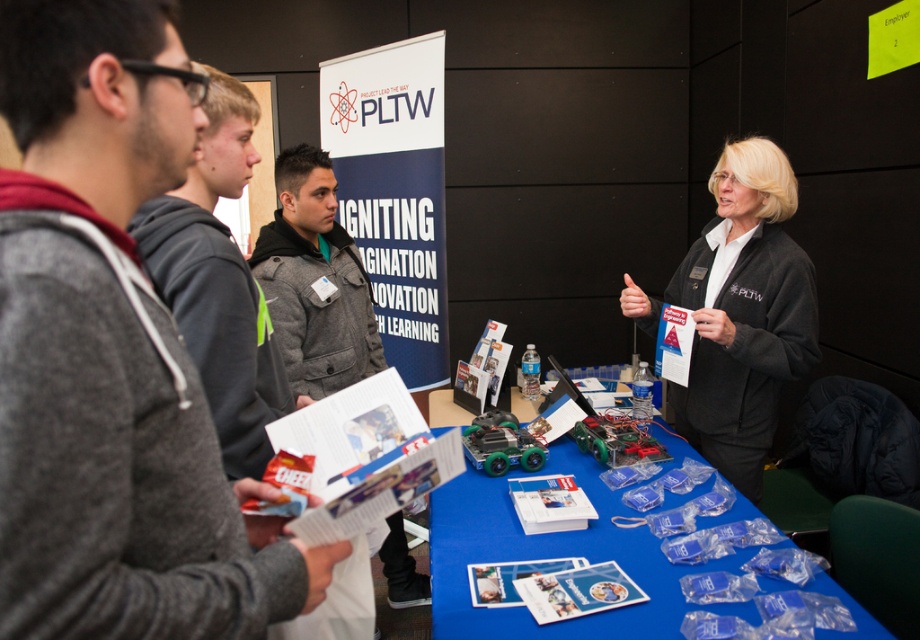
You are a participant at the event and need to place a folder on the blue plastic table at center. You are currently holding the folder and standing where the gray wool jacket at center is located. Can you reach the table without moving your feet? Please explain your reasoning.

The blue plastic table at center and gray wool jacket at center are 36.30 inches apart from each other. Since the distance is about 3 feet, which is within typical reaching distance for an average person, you can likely place the folder on the blue plastic table at center without moving your feet.

You are standing at the center of the image and want to hand out a brochure to the person wearing the gray sweater at left. In which direction should you move to reach them?

The gray sweater at left is located at point (111, 355), so you should move to the left to reach them.

You are standing at the career fair and want to take a photo of both the point at position (167,369) and the point at position (280,189). Which point should you focus on first to ensure both are in focus?

You should focus on the point at position (280,189) first because it is farther from the camera compared to the point at (167,369). By focusing on the farther point, the closer point will also be within the depth of field, ensuring both are in focus.